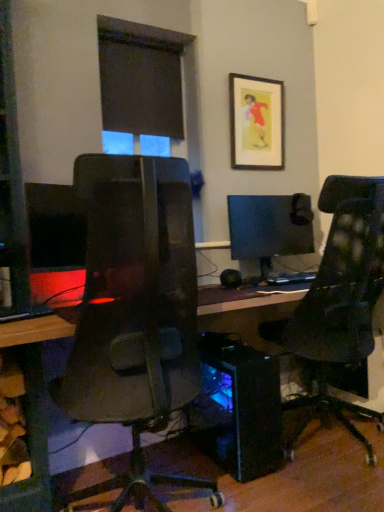
Question: From the image's perspective, is transparent blue computer tower at center above matte black monitor at center, the first computer monitor positioned from the back?

Choices:
 (A) yes
 (B) no

Answer: (B)

Question: Considering the relative sizes of transparent blue computer tower at center and matte black monitor at center, the 2th computer monitor viewed from the left, in the image provided, is transparent blue computer tower at center taller than matte black monitor at center, the 2th computer monitor viewed from the left,?

Choices:
 (A) no
 (B) yes

Answer: (B)

Question: Can you confirm if transparent blue computer tower at center is thinner than matte black monitor at center, the 1th computer monitor positioned from the right?

Choices:
 (A) no
 (B) yes

Answer: (A)

Question: Is transparent blue computer tower at center far away from matte black monitor at center, which ranks as the 2th computer monitor in front-to-back order?

Choices:
 (A) no
 (B) yes

Answer: (A)

Question: Is transparent blue computer tower at center bigger than matte black monitor at center, the 1th computer monitor positioned from the right?

Choices:
 (A) no
 (B) yes

Answer: (B)

Question: Is transparent blue computer tower at center to the right of matte black monitor at center, the first computer monitor positioned from the back, from the viewer's perspective?

Choices:
 (A) no
 (B) yes

Answer: (A)

Question: From the image's perspective, is wooden framed picture at upper center located above transparent blue computer tower at center?

Choices:
 (A) yes
 (B) no

Answer: (A)

Question: From a real-world perspective, does wooden framed picture at upper center sit lower than transparent blue computer tower at center?

Choices:
 (A) yes
 (B) no

Answer: (B)

Question: Is wooden framed picture at upper center further to camera compared to transparent blue computer tower at center?

Choices:
 (A) no
 (B) yes

Answer: (B)

Question: Is there a large distance between wooden framed picture at upper center and transparent blue computer tower at center?

Choices:
 (A) no
 (B) yes

Answer: (B)

Question: Considering the relative sizes of wooden framed picture at upper center and transparent blue computer tower at center in the image provided, is wooden framed picture at upper center smaller than transparent blue computer tower at center?

Choices:
 (A) no
 (B) yes

Answer: (B)

Question: From the image's perspective, is wooden framed picture at upper center below transparent blue computer tower at center?

Choices:
 (A) yes
 (B) no

Answer: (B)

Question: Is matte black monitor at left, which appears as the 1th computer monitor when viewed from the front, shorter than transparent blue computer tower at center?

Choices:
 (A) yes
 (B) no

Answer: (A)